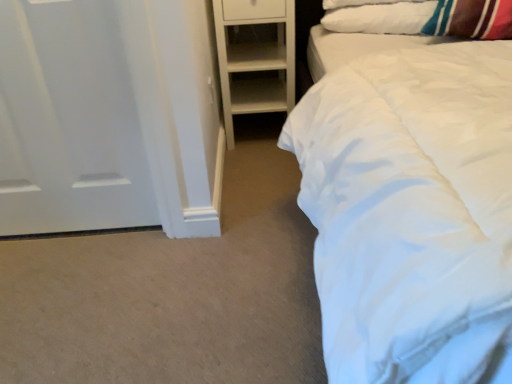
At what (x,y) coordinates should I click in order to perform the action: click on blank area beneath white matte door at left (from a real-world perspective). Please return your answer as a coordinate pair (x, y). The width and height of the screenshot is (512, 384). Looking at the image, I should click on (81, 226).